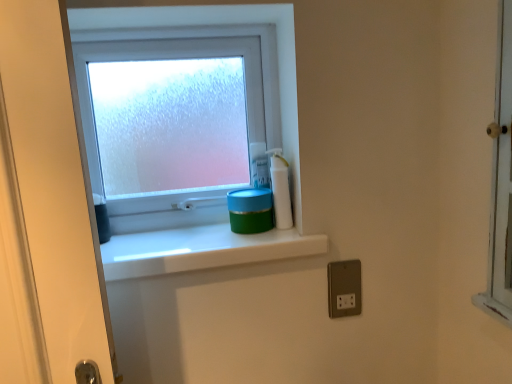
Question: Would you say frosted glass window at upper center is inside or outside satin silver outlet at lower right?

Choices:
 (A) outside
 (B) inside

Answer: (A)

Question: Relative to satin silver outlet at lower right, is frosted glass window at upper center in front or behind?

Choices:
 (A) behind
 (B) front

Answer: (A)

Question: Which of these objects is positioned farthest from the white glossy bottle at upper right?

Choices:
 (A) blue plastic container at upper right
 (B) frosted glass window at upper center
 (C) green matte container at center
 (D) satin silver outlet at lower right

Answer: (B)

Question: Based on their relative distances, which object is farther from the satin silver outlet at lower right?

Choices:
 (A) frosted glass window at upper center
 (B) blue plastic container at upper right
 (C) green matte container at center
 (D) white glossy bottle at upper right

Answer: (A)